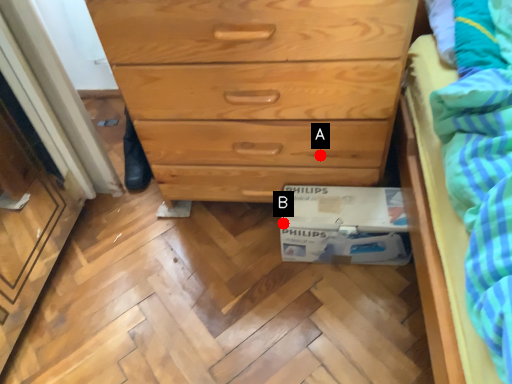
Question: Two points are circled on the image, labeled by A and B beside each circle. Which point is closer to the camera taking this photo?

Choices:
 (A) A is closer
 (B) B is closer

Answer: (A)